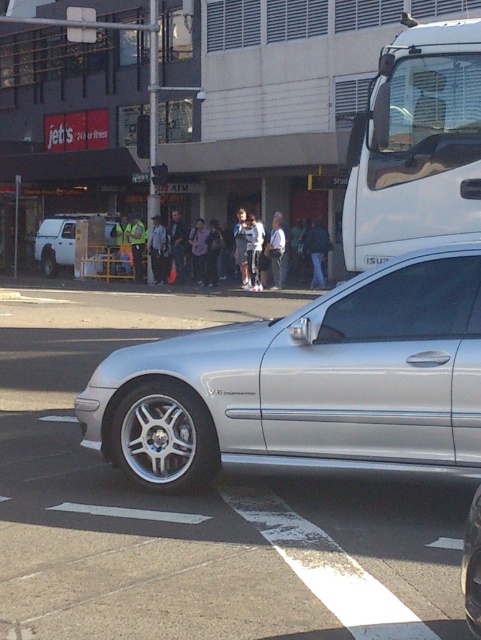
Question: Does metallic silver truck at upper right appear over silver metallic wheel at lower left?

Choices:
 (A) yes
 (B) no

Answer: (A)

Question: Which point is closer to the camera taking this photo?

Choices:
 (A) (206, 468)
 (B) (230, 445)
 (C) (161, 432)

Answer: (B)

Question: Based on their relative distances, which object is farther from the metallic silver truck at upper right?

Choices:
 (A) silver metallic wheel at center
 (B) silver metallic wheel at lower left
 (C) silver metallic rim at center
 (D) white matte van at left

Answer: (D)

Question: Does silver metallic rim at center come in front of brushed metal wheel at lower left?

Choices:
 (A) yes
 (B) no

Answer: (A)

Question: Can you confirm if silver metallic car at center is positioned to the left of silver metallic rim at center?

Choices:
 (A) yes
 (B) no

Answer: (B)

Question: Estimate the real-world distances between objects in this image. Which object is farther from the silver metallic wheel at center?

Choices:
 (A) silver metallic rim at center
 (B) brushed metal wheel at lower left

Answer: (B)